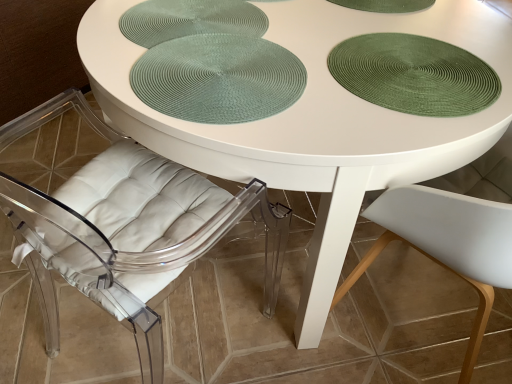
Identify the location of free point to the right of green woven placemat at center. The height and width of the screenshot is (384, 512). (371, 84).